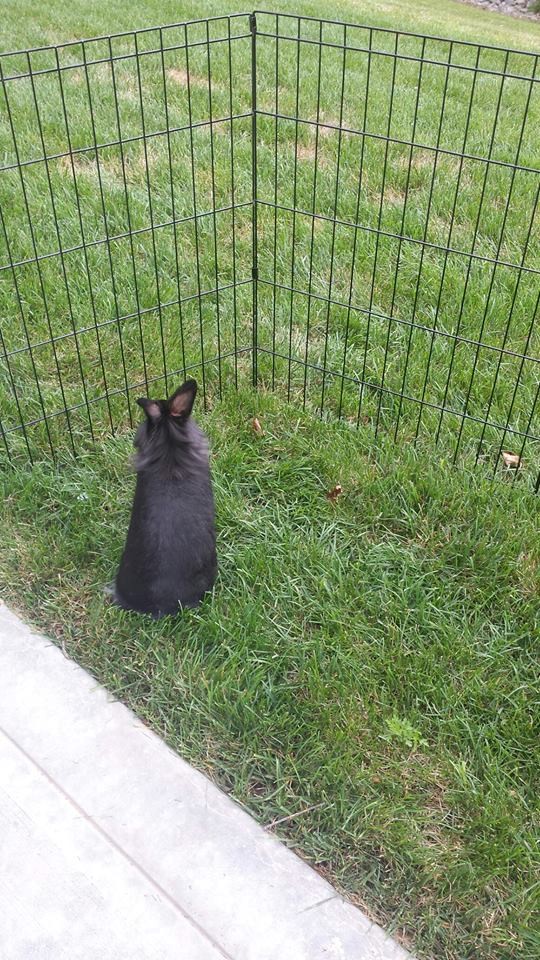
Image resolution: width=540 pixels, height=960 pixels. I want to click on plant, so click(x=534, y=6).